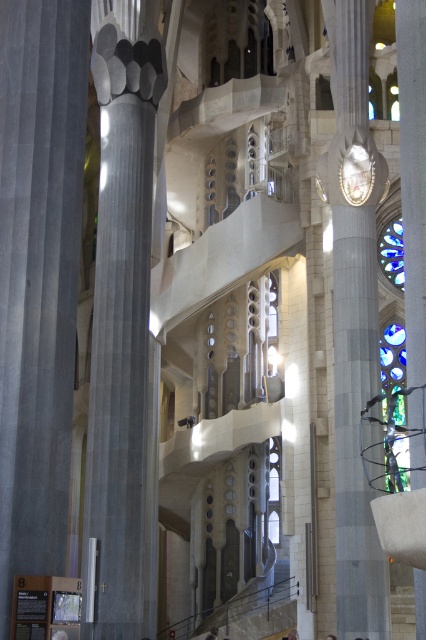
You are standing inside a cathedral and want to know how far the point at coordinates (x=62, y=248) is from where you are standing. Can you determine the distance?

The point at coordinates (x=62, y=248) is 44.50 meters from the camera, so the distance from where you are standing is 44.50 meters.

You are standing at point (39,276) in the cathedral. What object is located exactly at your current position?

The gray stone column at left is located exactly at point (39,276).

You are standing in the cathedral and want to walk from the starting point to the exit. You see two points marked on the floor. The first point is at coordinates point (25, 396) and the second point is at coordinates point (362, 276). Which point is closer to you as you stand at the starting position?

Point (25, 396) is in front of point (362, 276), so it is closer to you as you stand at the starting position.